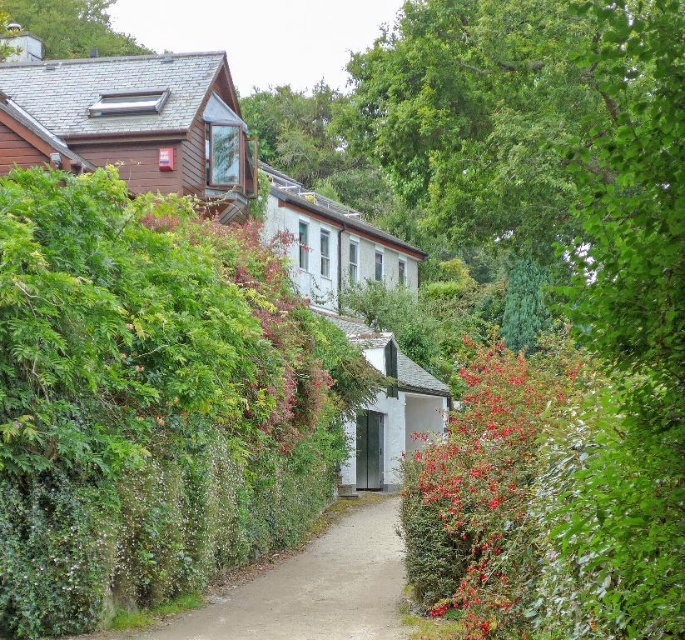
You are a painter wanting to capture the scene. You have a canvas that can only fit the width of the white matte cottage at center. Can you fit the wooden cabin at upper left on the same canvas?

The wooden cabin at upper left is narrower than the white matte cottage at center, so yes, it can fit on the canvas designed for the cottage.

You are standing at the point labeled point (186, 122) and want to walk to point (342, 205). Which direction should you face to move towards your destination?

You should face away from the camera because point (342, 205) is further away from the camera compared to point (186, 122).